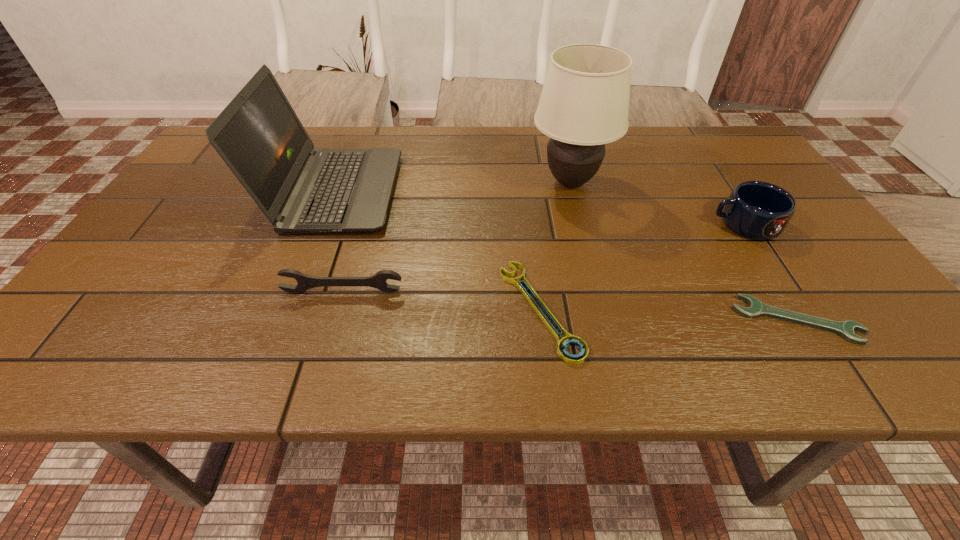
This screenshot has height=540, width=960. I want to click on vacant space in between the tallest wrench and the lampshade, so click(x=457, y=237).

At what (x,y) coordinates should I click in order to perform the action: click on vacant area that lies between the second wrench from right to left and the rightmost wrench. Please return your answer as a coordinate pair (x, y). The width and height of the screenshot is (960, 540). Looking at the image, I should click on (668, 315).

Image resolution: width=960 pixels, height=540 pixels. Find the location of `vacant space that's between the rightmost wrench and the laptop_computer`. vacant space that's between the rightmost wrench and the laptop_computer is located at coordinates (565, 255).

Identify the location of vacant area that lies between the fourth shortest object and the second wrench from left to right. The image size is (960, 540). (642, 267).

Locate an element on the screen. This screenshot has width=960, height=540. vacant region between the lampshade and the rightmost wrench is located at coordinates (684, 251).

The height and width of the screenshot is (540, 960). In order to click on free space between the fifth shortest object and the second wrench from right to left in this screenshot , I will do `click(438, 251)`.

At what (x,y) coordinates should I click in order to perform the action: click on object identified as the third closest to the second wrench from right to left. Please return your answer as a coordinate pair (x, y). The width and height of the screenshot is (960, 540). Looking at the image, I should click on (258, 135).

Where is `the third closest object to the rightmost wrench`? This screenshot has width=960, height=540. the third closest object to the rightmost wrench is located at coordinates (584, 104).

Identify which wrench is the third closest to the third tallest object. Please provide its 2D coordinates. Your answer should be formatted as a tuple, i.e. [(x, y)], where the tuple contains the x and y coordinates of a point satisfying the conditions above.

[(305, 282)]

In order to click on wrench identified as the second closest to the fourth shortest object in this screenshot , I will do `click(570, 339)`.